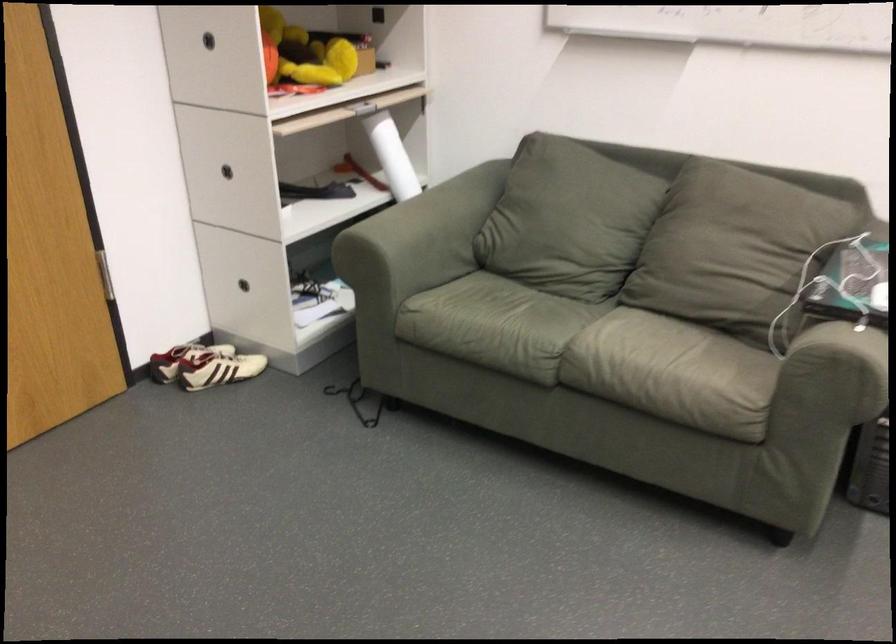
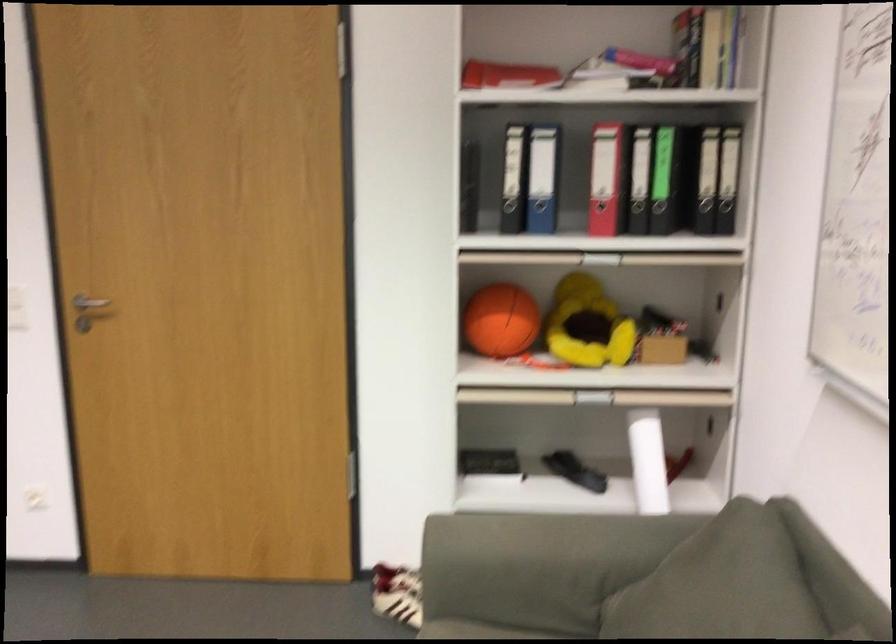
Question: I am providing you with two images of the same scene from different viewpoints. After the viewpoint changes to image2, which objects are now occluded?

Choices:
 (A) black drawer handle
 (B) red book
 (C) metal door handle
 (D) blue storage bin

Answer: (A)